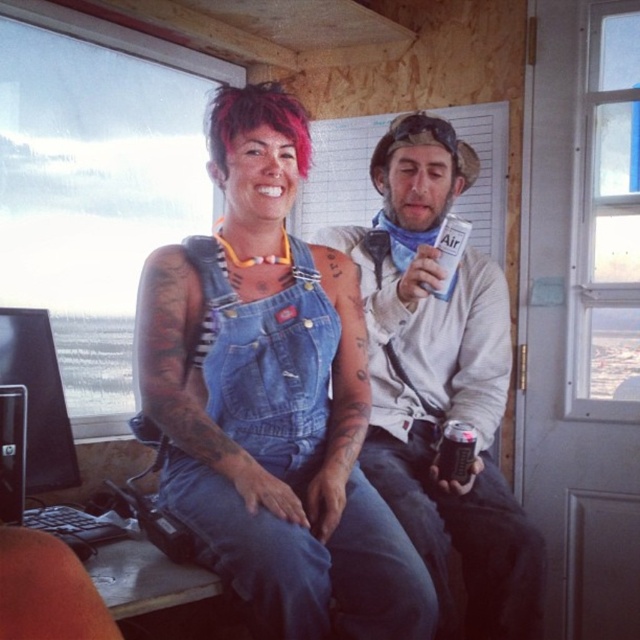
You are a fashion designer trying to create a layered outfit. You have both the denim overalls at center and the denim jacket at center in your collection. Which item should you place on top to ensure the jacket is visible?

The denim jacket at center should be placed on top of the denim overalls at center to ensure visibility since the denim overalls at center is positioned over the denim jacket at center in the image.

You are organizing a photo shoot and need to place a new accessory between the denim jacket at center and the orange matte keyboard at lower left. Based on their positions, which object should the accessory be closer to?

The denim jacket at center is positioned on the right side of the orange matte keyboard at lower left, so the accessory should be placed closer to the orange matte keyboard at lower left since it is on the left side of the denim jacket.

You are trying to decide which item to grab first from the scene. Based on their sizes, which one is taller between the denim jacket at center and the pink dyed hair at upper center?

The denim jacket at center is taller than the pink dyed hair at upper center according to the description.